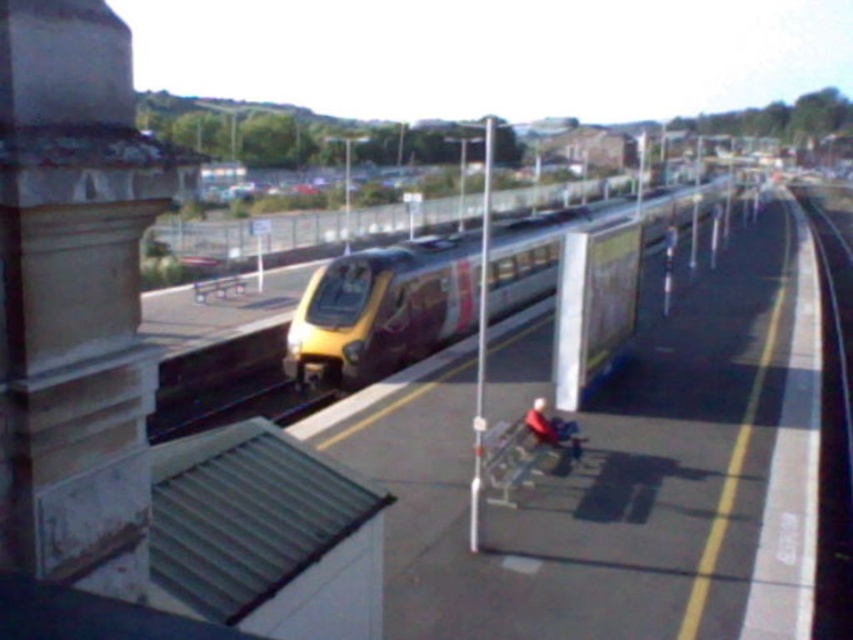
You are a maintenance worker needing to inspect the gap between the yellow metallic train at center and the black metal train track at lower left. Your tool kit is 2 meters long. Can you safely measure the gap with your tool?

The gap between the yellow metallic train at center and the black metal train track at lower left is 6.70 meters. Since your tool kit is only 2 meters long, it is not long enough to measure the entire gap safely. You will need a longer tool or a different method to assess the distance properly.

You are a maintenance worker inspecting the train station. You need to access the black metal train track at lower left for repairs. However, there is a stone column at left in the way. Based on their positions, can you reach the track without moving the column?

The stone column at left is above the black metal train track at lower left, so you can access the track by moving around the column from below since it is positioned higher up.

You are standing on the train station platform and notice two points marked on the ground. The first point is at coordinate point (77,337) and the second is at coordinate point (281,412). Which point is closer to your current position?

Point (77,337) is closer to the camera than point (281,412), so the first point is closer to your current position.